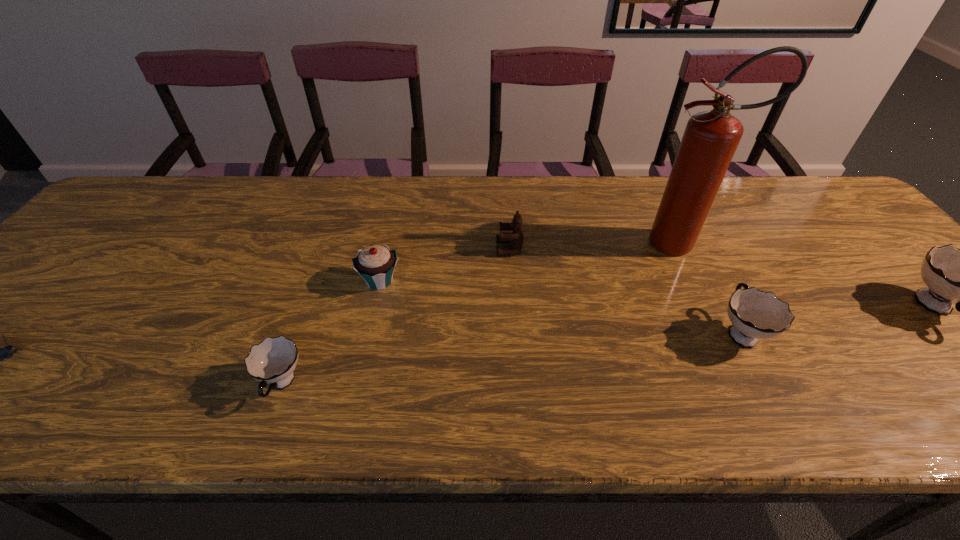
You are a GUI agent. You are given a task and a screenshot of the screen. Output one action in this format:
    pyautogui.click(x=<x>, y=<y>)
    Task: Click on the free region located 0.290m on the face of the fourth object from left to right
    
    Given the screenshot: What is the action you would take?
    pyautogui.click(x=386, y=249)

The image size is (960, 540). I want to click on vacant space located on the face of the fourth object from left to right, so click(x=466, y=249).

Identify the location of free location located on the face of the fourth object from left to right. (375, 249).

Identify the location of vacant space located 0.190m from the nozzle of the tallest object. This screenshot has width=960, height=540. (569, 243).

Locate an element on the screen. vacant area located from the nozzle of the tallest object is located at coordinates (614, 243).

This screenshot has height=540, width=960. Identify the location of vacant position located 0.170m from the nozzle of the tallest object. (577, 243).

Identify the location of free space at the far edge of the desktop. (441, 200).

Locate an element on the screen. free region at the near edge of the desktop is located at coordinates tap(496, 372).

In order to click on vacant area at the right edge in this screenshot , I will do `click(869, 298)`.

I want to click on vacant position at the far left corner of the desktop, so click(x=145, y=182).